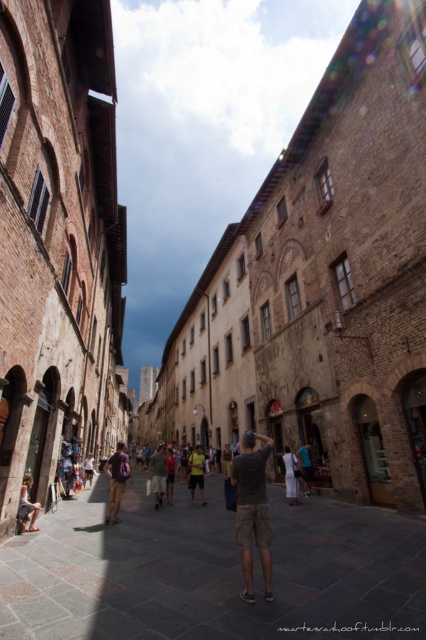
You are standing at the entrance of the historic European town alleyway and want to take a photo. There are two points in the scene labeled as point 1 and point 2. Point 1 is at coordinates point (x=255, y=474) and point 2 is at point (x=29, y=483). Which point will appear larger in your photo?

Point 1 at coordinates point (x=255, y=474) will appear larger in the photo because it is closer to the camera than point 2 at point (x=29, y=483).